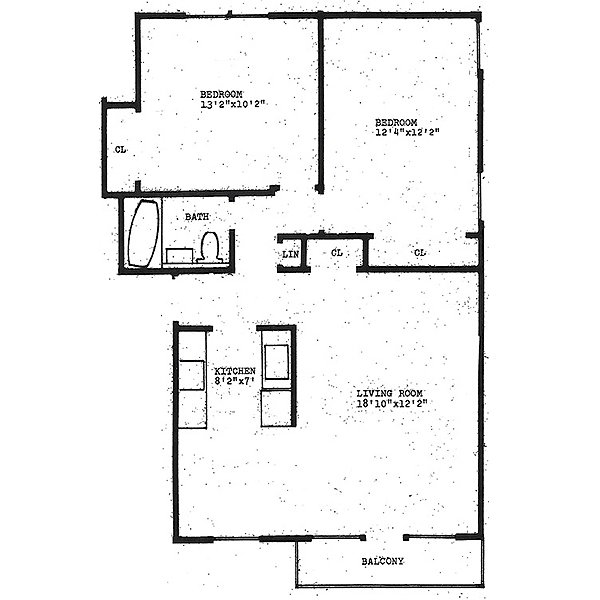
Identify the location of tub. (150, 243).